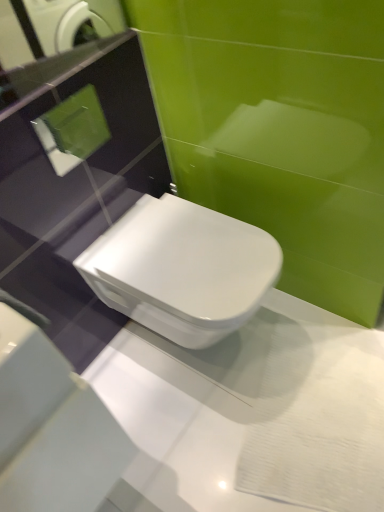
Question: In terms of height, does white glossy toilet at center look taller or shorter compared to glossy glass mirror at upper left?

Choices:
 (A) tall
 (B) short

Answer: (A)

Question: Considering their positions, is white glossy toilet at center located in front of or behind glossy glass mirror at upper left?

Choices:
 (A) behind
 (B) front

Answer: (A)

Question: Considering the positions of white glossy toilet at center and glossy glass mirror at upper left in the image, is white glossy toilet at center wider or thinner than glossy glass mirror at upper left?

Choices:
 (A) wide
 (B) thin

Answer: (A)

Question: Is glossy glass mirror at upper left inside the boundaries of white glossy toilet at center, or outside?

Choices:
 (A) outside
 (B) inside

Answer: (A)

Question: Is glossy glass mirror at upper left wider or thinner than white glossy toilet at center?

Choices:
 (A) thin
 (B) wide

Answer: (A)

Question: Is glossy glass mirror at upper left taller or shorter than white glossy toilet at center?

Choices:
 (A) short
 (B) tall

Answer: (A)

Question: From a real-world perspective, is glossy glass mirror at upper left positioned above or below white glossy toilet at center?

Choices:
 (A) below
 (B) above

Answer: (B)